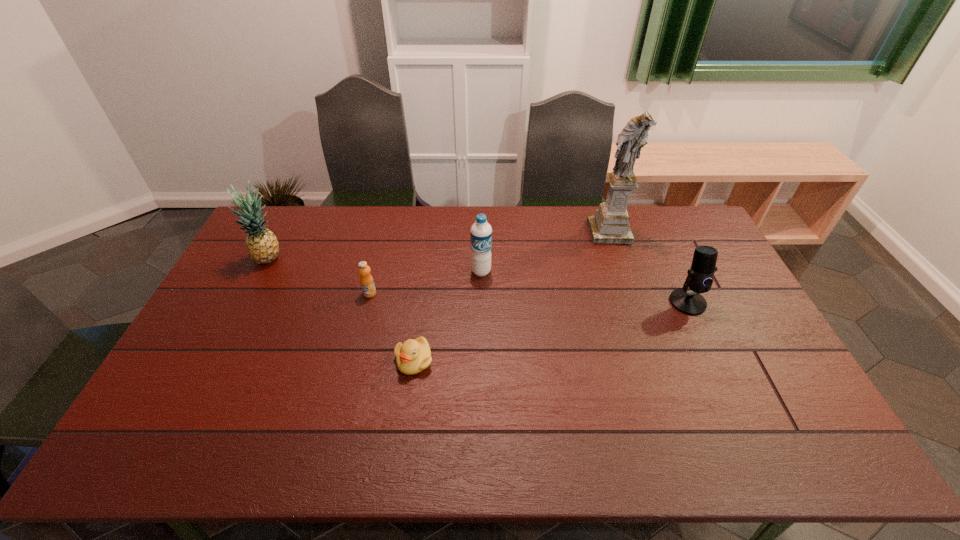
At what (x,y) coordinates should I click in order to perform the action: click on vacant region between the water bottle and the fifth object from right to left. Please return your answer as a coordinate pair (x, y). The width and height of the screenshot is (960, 540). Looking at the image, I should click on (425, 282).

Find the location of a particular element. This screenshot has height=540, width=960. empty space between the third object from left to right and the second object from left to right is located at coordinates (392, 327).

Locate an element on the screen. free space between the rightmost object and the duckling is located at coordinates (551, 332).

Find the location of a particular element. vacant area that lies between the second object from left to right and the duckling is located at coordinates (392, 327).

Where is `the closest object to the second object from left to right`? Image resolution: width=960 pixels, height=540 pixels. the closest object to the second object from left to right is located at coordinates (413, 356).

Choose which object is the nearest neighbor to the water bottle. Please provide its 2D coordinates. Your answer should be formatted as a tuple, i.e. [(x, y)], where the tuple contains the x and y coordinates of a point satisfying the conditions above.

[(413, 356)]